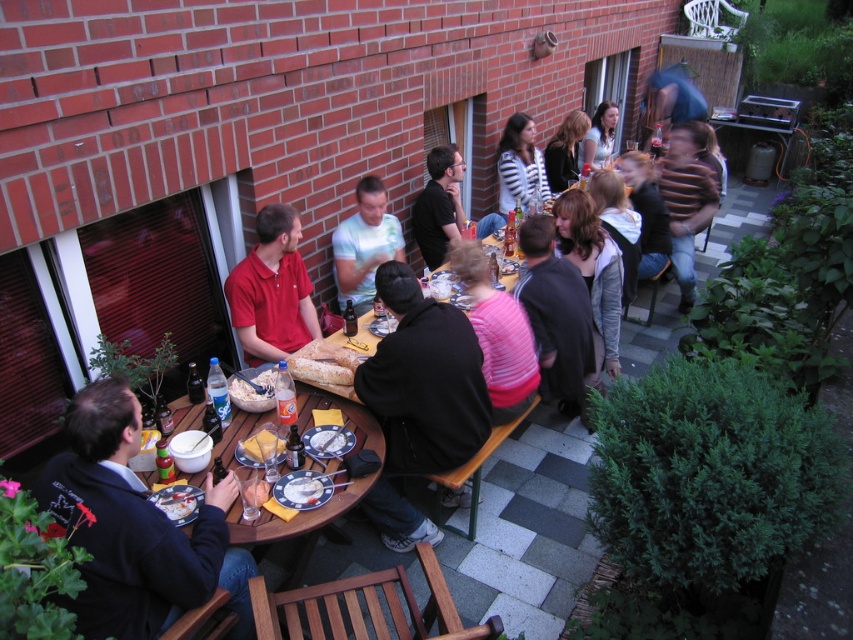
Is brown striped sweater at upper right to the left of white glossy bowl at lower left from the viewer's perspective?

No, brown striped sweater at upper right is not to the left of white glossy bowl at lower left.

Is brown striped sweater at upper right positioned in front of white glossy bowl at lower left?

That is False.

The width and height of the screenshot is (853, 640). What do you see at coordinates (688, 198) in the screenshot?
I see `brown striped sweater at upper right` at bounding box center [688, 198].

Where is `brown striped sweater at upper right`? This screenshot has width=853, height=640. brown striped sweater at upper right is located at coordinates (688, 198).

Is point (554, 138) more distant than point (268, 372)?

Yes.

Which is in front, point (560, 186) or point (256, 378)?

Positioned in front is point (256, 378).

Between point (546, 148) and point (233, 385), which one is positioned in front?

Point (233, 385)

In order to click on dark brown hair at upper center in this screenshot , I will do `click(564, 150)`.

Between wooden table at lower center and black matte shirt at upper center, which one appears on the right side from the viewer's perspective?

black matte shirt at upper center

I want to click on wooden table at lower center, so click(x=297, y=522).

At what (x,y) coordinates should I click in order to perform the action: click on wooden table at lower center. Please return your answer as a coordinate pair (x, y). The image size is (853, 640). Looking at the image, I should click on (297, 522).